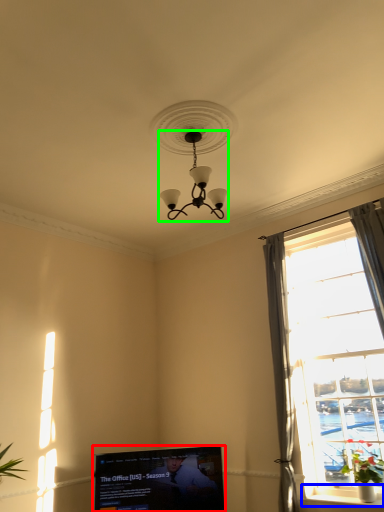
Question: Considering the real-world distances, which object is closest to television (highlighted by a red box)? window sill (highlighted by a blue box) or lamp (highlighted by a green box).

Choices:
 (A) window sill
 (B) lamp

Answer: (A)